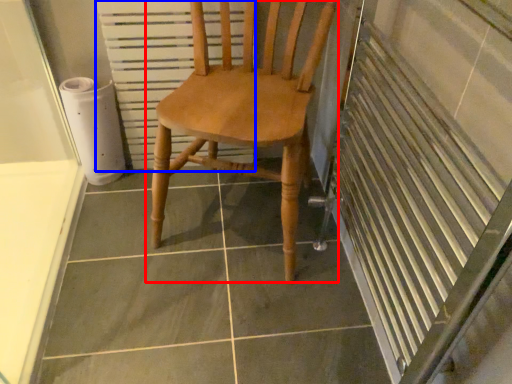
Question: Which of the following is the closest to the observer, chair (highlighted by a red box) or radiator (highlighted by a blue box)?

Choices:
 (A) chair
 (B) radiator

Answer: (A)